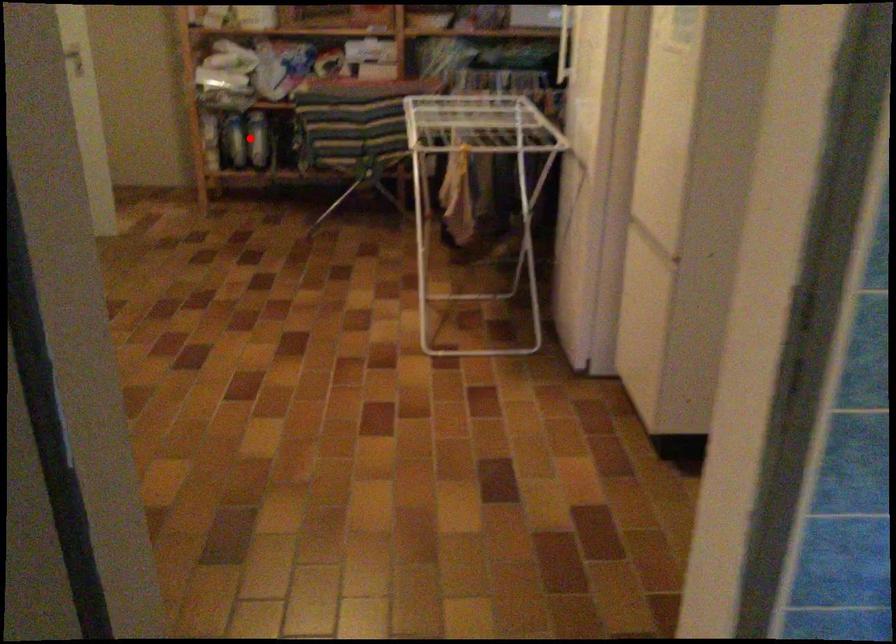
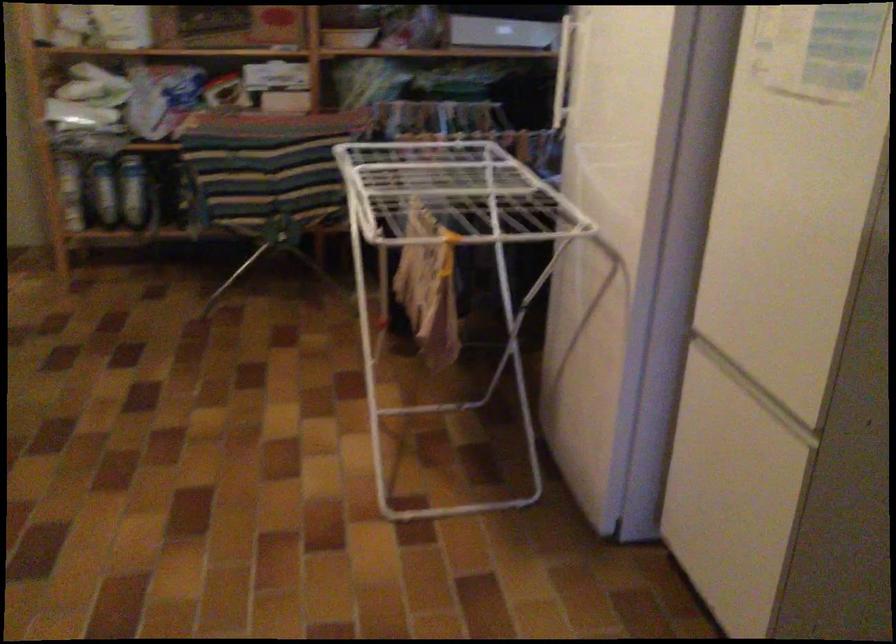
Question: I am providing you with two images of the same scene from different viewpoints. A red point is shown in image1. For the corresponding object point in image2, is it positioned nearer or farther from the camera?

Choices:
 (A) Nearer
 (B) Farther

Answer: (A)